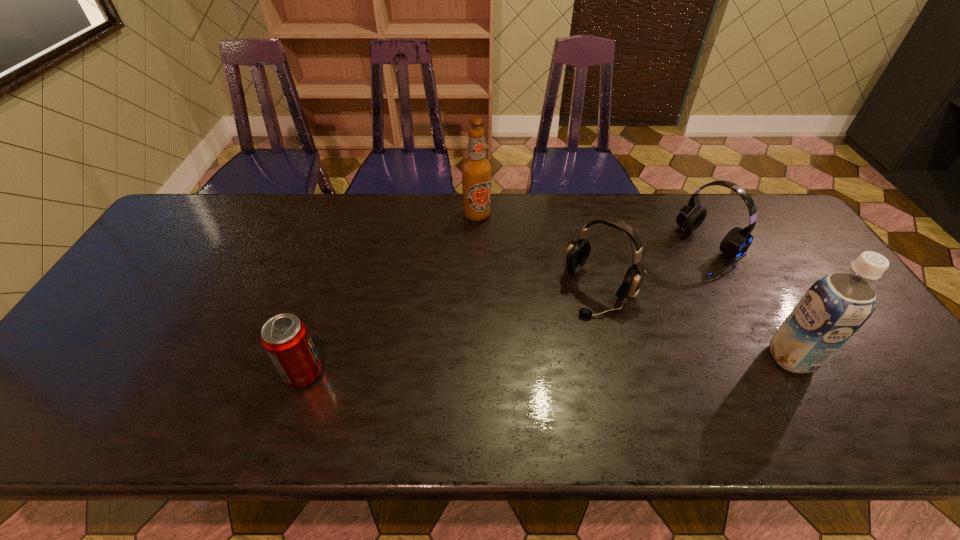
I want to click on unoccupied position between the soda can and the soya milk, so click(x=547, y=365).

This screenshot has width=960, height=540. I want to click on free point between the right headset and the second object from left to right, so (x=594, y=232).

This screenshot has height=540, width=960. Identify the location of vacant space that's between the soya milk and the right headset. (751, 303).

You are a GUI agent. You are given a task and a screenshot of the screen. Output one action in this format:
    pyautogui.click(x=<x>, y=<y>)
    Task: Click on the vacant area that lies between the leftmost object and the beer bottle
    The image size is (960, 540).
    Given the screenshot: What is the action you would take?
    point(391,294)

Locate an element on the screen. This screenshot has height=540, width=960. free space between the soda can and the second object from left to right is located at coordinates (391, 294).

At what (x,y) coordinates should I click in order to perform the action: click on empty space between the beer bottle and the right headset. Please return your answer as a coordinate pair (x, y). Looking at the image, I should click on (594, 232).

The height and width of the screenshot is (540, 960). I want to click on free space between the soda can and the left headset, so click(451, 332).

Image resolution: width=960 pixels, height=540 pixels. Identify the location of vacant region between the left headset and the right headset. (655, 270).

The height and width of the screenshot is (540, 960). I want to click on unoccupied area between the right headset and the second object from left to right, so click(594, 232).

The height and width of the screenshot is (540, 960). What are the coordinates of `vacant area between the soya milk and the left headset` in the screenshot? It's located at (695, 324).